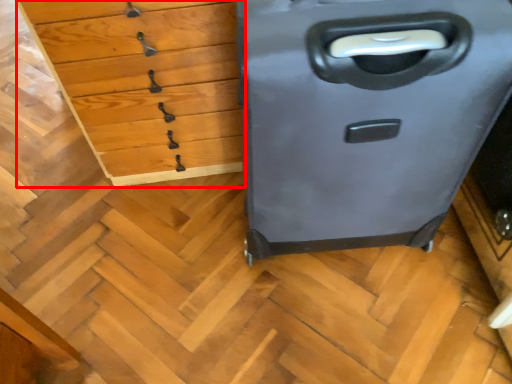
Question: From the image's perspective, what is the correct spatial relationship of chest of drawers (annotated by the red box) in relation to file cabinet?

Choices:
 (A) above
 (B) below

Answer: (A)